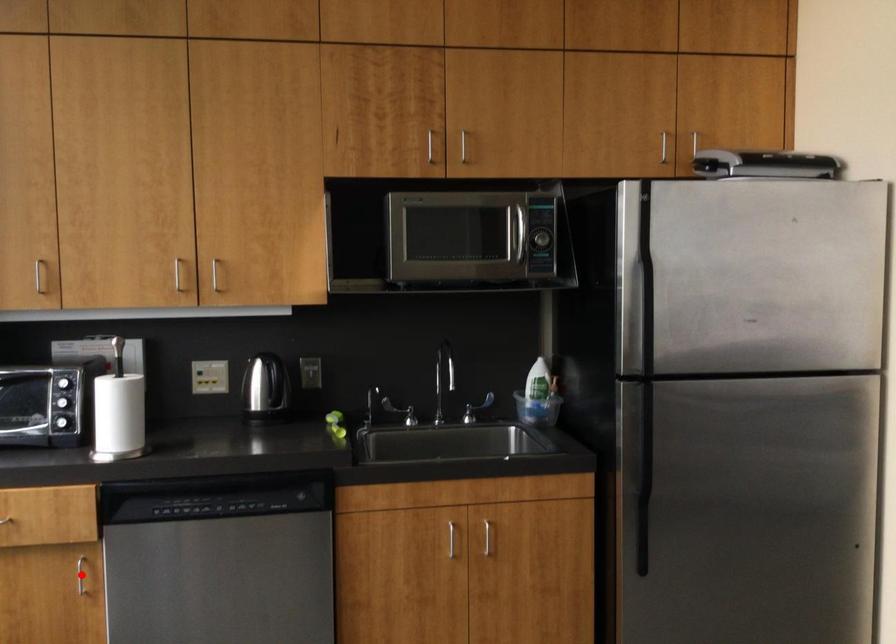
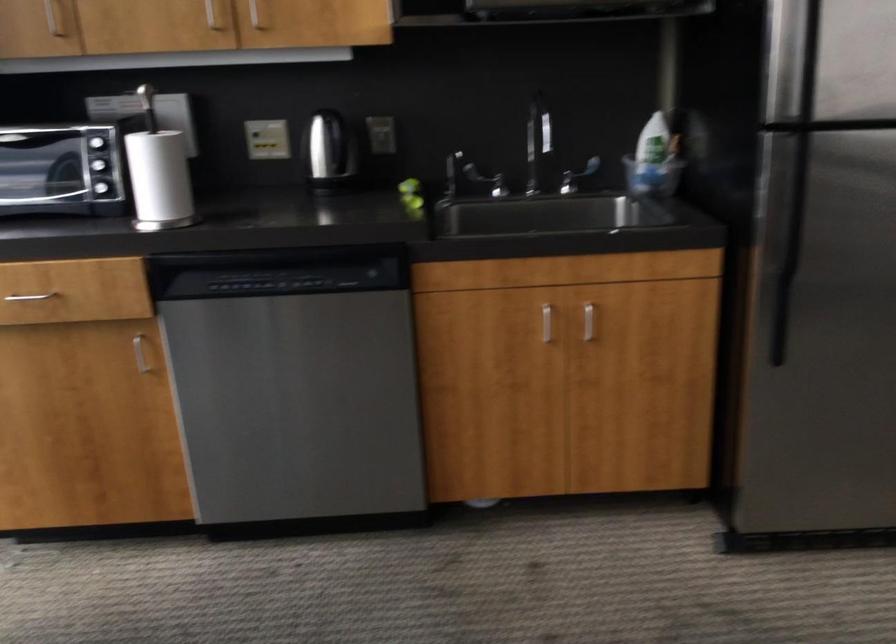
In the second image, find the point that corresponds to the highlighted location in the first image.

(140, 354)